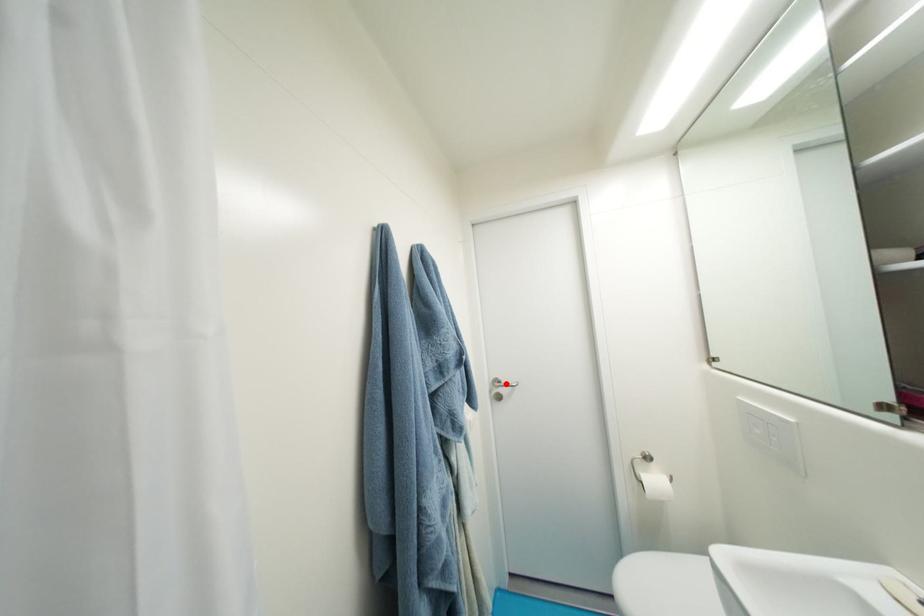
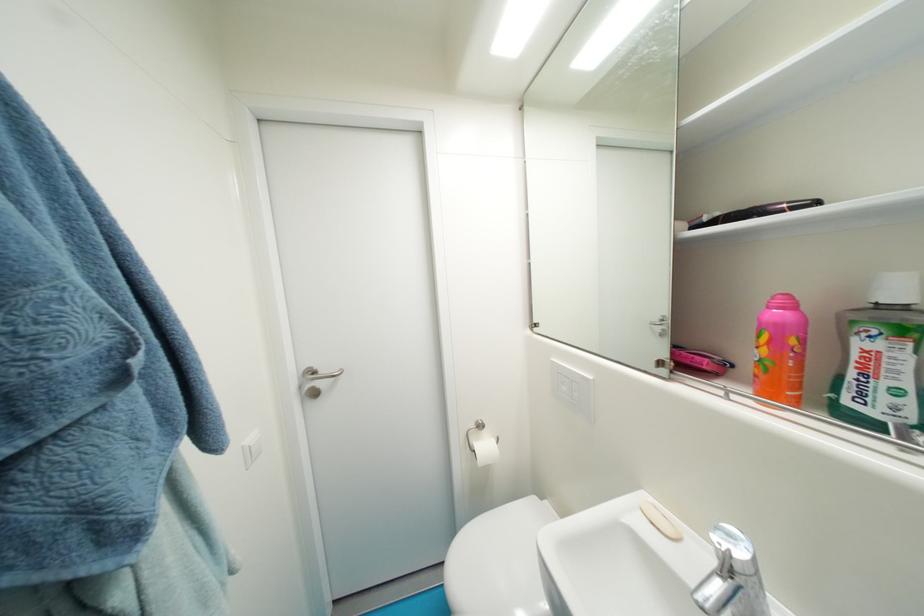
Find the pixel in the second image that matches the highlighted location in the first image.

(322, 374)